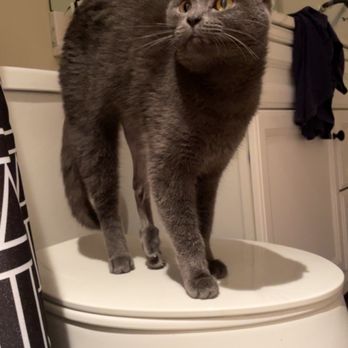
Find the location of `toilet lid`. toilet lid is located at coordinates (258, 290).